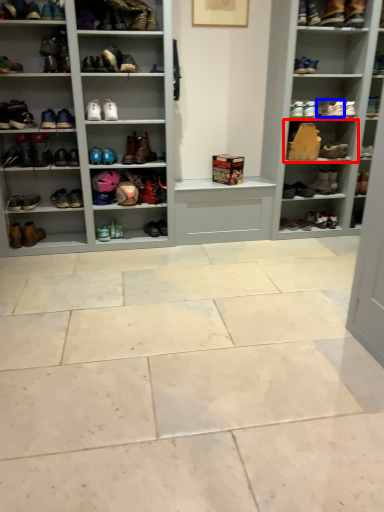
Question: Which of the following is the farthest to the observer, shelf (highlighted by a red box) or shoe (highlighted by a blue box)?

Choices:
 (A) shelf
 (B) shoe

Answer: (A)